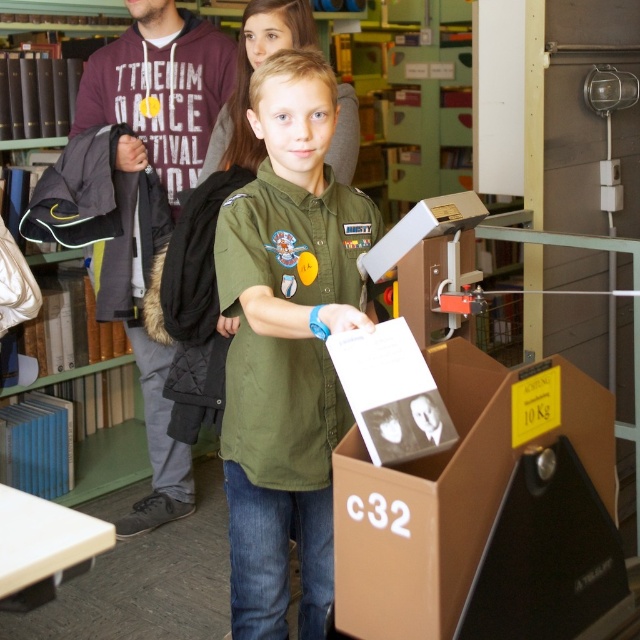
Can you confirm if green uniform shirt at center is positioned below dark gray hoodie at upper left?

Yes, green uniform shirt at center is below dark gray hoodie at upper left.

From the picture: Is green uniform shirt at center to the left of dark gray hoodie at upper left from the viewer's perspective?

In fact, green uniform shirt at center is to the right of dark gray hoodie at upper left.

Who is more distant from viewer, (228,376) or (163,20)?

Point (163,20)

Find the location of `green uniform shirt at center`. green uniform shirt at center is located at coordinates (285, 346).

Looking at this image, between dark gray hoodie at upper left and brown cardboard box at center, which one appears on the right side from the viewer's perspective?

dark gray hoodie at upper left is more to the right.

Who is lower down, dark gray hoodie at upper left or brown cardboard box at center?

brown cardboard box at center is lower down.

Who is more distant from viewer, (x=168, y=19) or (x=84, y=419)?

Point (x=84, y=419)

This screenshot has width=640, height=640. I want to click on dark gray hoodie at upper left, so tap(157, 90).

Does point (300, 385) lie in front of point (102, 364)?

Yes.

Does green uniform shirt at center have a smaller size compared to brown cardboard box at center?

Incorrect, green uniform shirt at center is not smaller in size than brown cardboard box at center.

Find the location of `green uniform shirt at center`. green uniform shirt at center is located at coordinates (285, 346).